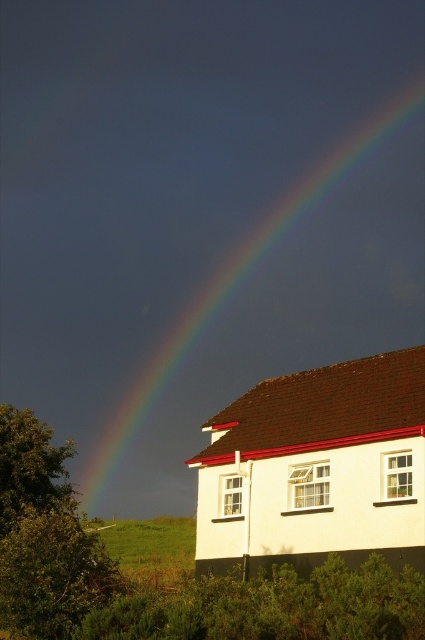
You are standing in the middle of a field looking at the rainbow at upper right. If you want to get closer to it, which direction should you move in?

The rainbow at upper right is a natural phenomenon and cannot be physically approached, so moving in any direction won t bring you closer to it.

You are standing in the middle of the field looking at the rainbow at upper right and the white painted wall at center. Which object is closer to you?

The rainbow at upper right is closer to you because the white painted wall at center is behind it.

You are an artist planning to paint the scene. You want to ensure the rainbow at upper right and the white painted wall at center are proportionate. Which object should you make wider in your painting to maintain accuracy?

The rainbow at upper right should be made wider in the painting since it is wider than the white painted wall at center according to the description.